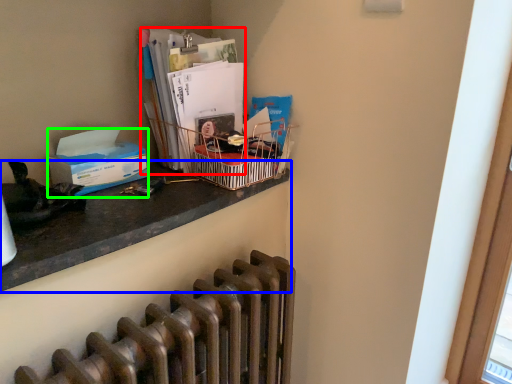
Question: Which object is positioned closest to magazine (highlighted by a red box)? Select from desk (highlighted by a blue box) and box (highlighted by a green box).

Choices:
 (A) desk
 (B) box

Answer: (B)